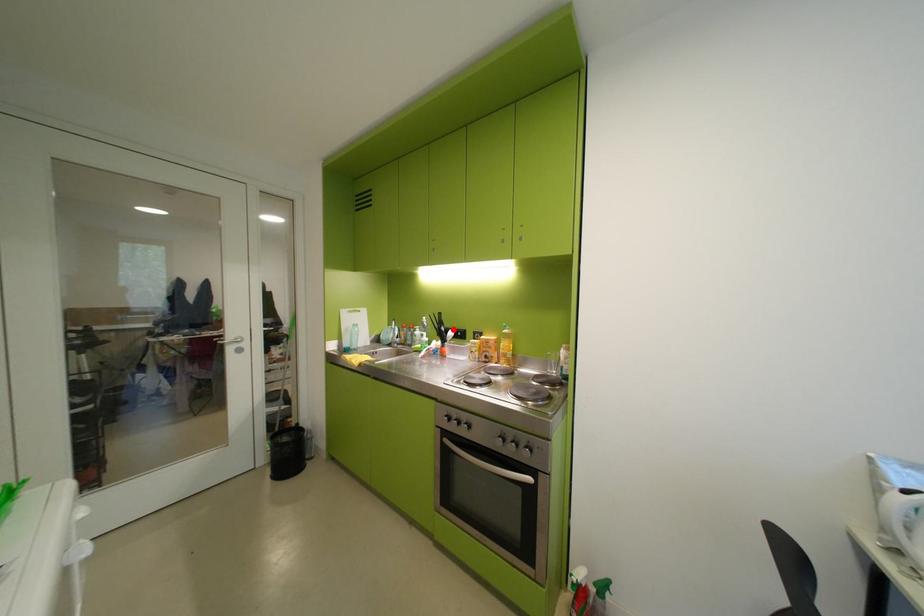
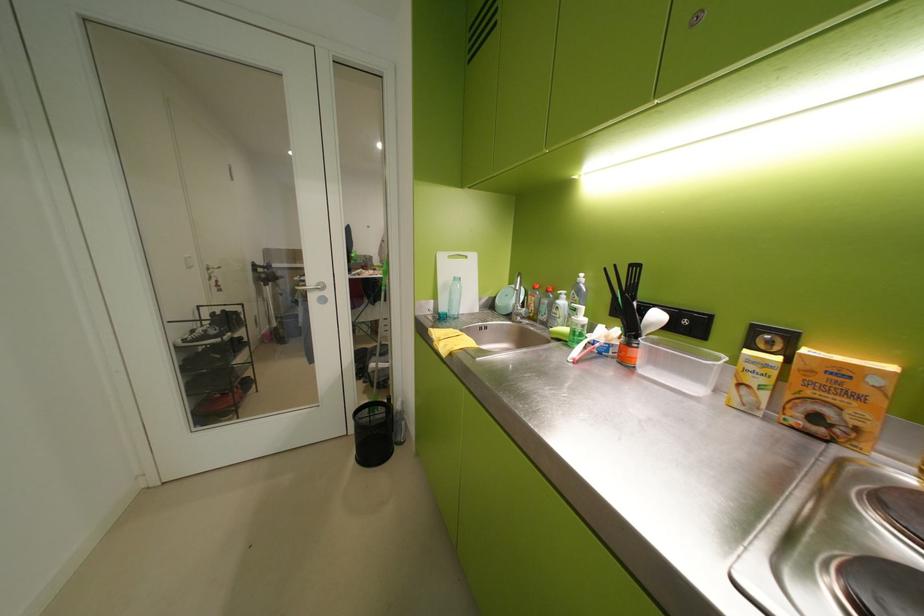
In the second image, find the point that corresponds to the highlighted location in the first image.

(646, 304)